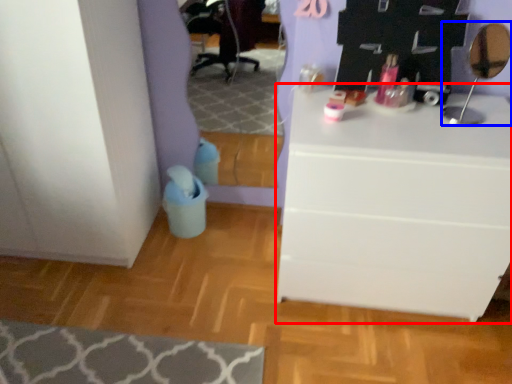
Question: Which point is further to the camera, chest of drawers (highlighted by a red box) or mirror (highlighted by a blue box)?

Choices:
 (A) chest of drawers
 (B) mirror

Answer: (B)